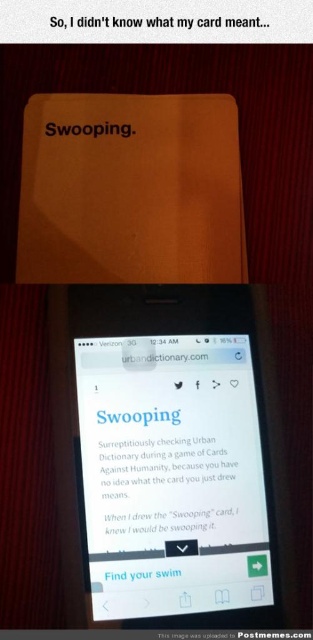
Can you confirm if white glossy screen at center is positioned to the right of white matte text at center?

Yes, white glossy screen at center is to the right of white matte text at center.

Does white glossy screen at center have a greater height compared to white matte text at center?

Yes, white glossy screen at center is taller than white matte text at center.

Which is behind, point (170, 369) or point (123, 577)?

The point (170, 369) is behind.

At what (x,y) coordinates should I click in order to perform the action: click on white glossy screen at center. Please return your answer as a coordinate pair (x, y). Looking at the image, I should click on (170, 474).

Looking at this image, who is positioned more to the right, white glossy screen at center or white paper at upper center?

white paper at upper center

Is white glossy screen at center to the right of white paper at upper center from the viewer's perspective?

Incorrect, white glossy screen at center is not on the right side of white paper at upper center.

Locate an element on the screen. Image resolution: width=313 pixels, height=640 pixels. white glossy screen at center is located at coordinates (170, 474).

Is white paper at center shorter than white matte text at center?

No, white paper at center is not shorter than white matte text at center.

Between point (162, 474) and point (157, 570), which one is positioned behind?

The point (162, 474) is behind.

Is point (188, 536) behind point (112, 572)?

Yes, it is behind point (112, 572).

Where is `white paper at center`? The width and height of the screenshot is (313, 640). white paper at center is located at coordinates click(x=165, y=486).